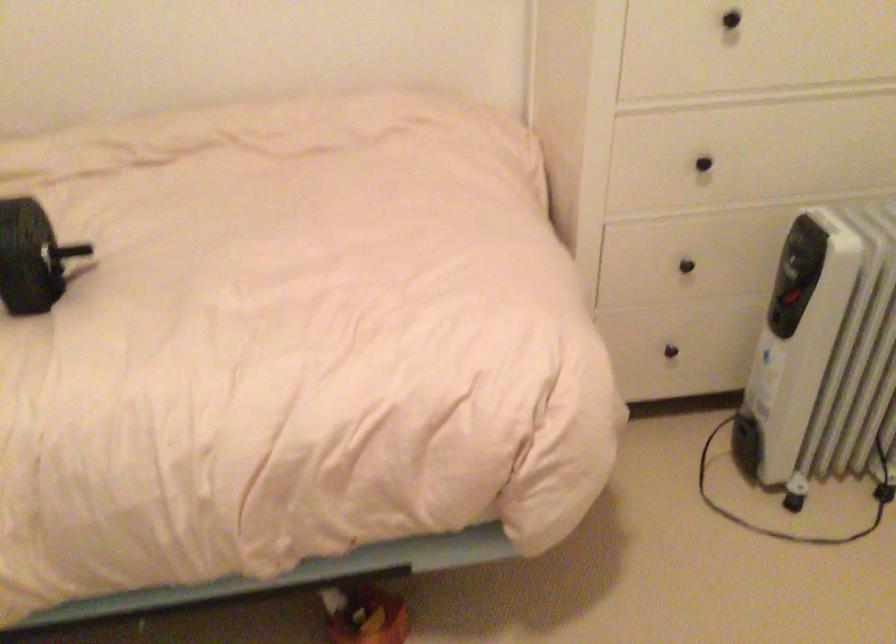
At what (x,y) coordinates should I click in order to perform the action: click on heater control dial. Please return your answer as a coordinate pair (x, y). Looking at the image, I should click on (30, 257).